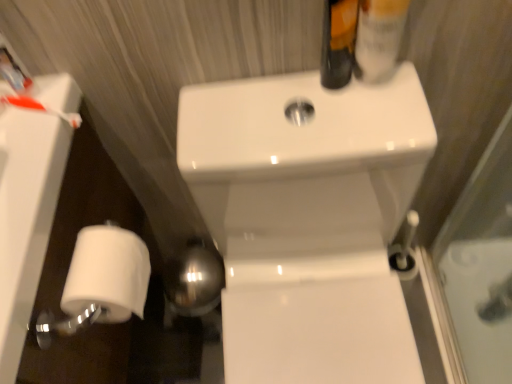
This screenshot has height=384, width=512. Describe the element at coordinates (309, 220) in the screenshot. I see `white glossy sink at center` at that location.

Describe the element at coordinates (379, 38) in the screenshot. I see `translucent plastic mouthwash at upper right` at that location.

This screenshot has height=384, width=512. Identify the location of matte black bottle at upper right. (338, 42).

From the picture: How distant is matte black bottle at upper right from white matte toilet paper at lower left?

A distance of 17.24 inches exists between matte black bottle at upper right and white matte toilet paper at lower left.

From the picture: Is matte black bottle at upper right positioned with its back to white matte toilet paper at lower left?

No, matte black bottle at upper right's orientation is not away from white matte toilet paper at lower left.

Considering the sizes of matte black bottle at upper right and white matte toilet paper at lower left in the image, is matte black bottle at upper right taller or shorter than white matte toilet paper at lower left?

In the image, matte black bottle at upper right appears to be taller than white matte toilet paper at lower left.

Does point (348, 78) lie behind point (142, 246)?

That is False.

Is white matte toilet paper at lower left facing away from translucent plastic mouthwash at upper right?

No, translucent plastic mouthwash at upper right is not at the back of white matte toilet paper at lower left.

Is white matte toilet paper at lower left outside of translucent plastic mouthwash at upper right?

Absolutely, white matte toilet paper at lower left is external to translucent plastic mouthwash at upper right.

Between white matte toilet paper at lower left and translucent plastic mouthwash at upper right, which one has larger size?

white matte toilet paper at lower left is bigger.

Who is taller, white matte toilet paper at lower left or translucent plastic mouthwash at upper right?

white matte toilet paper at lower left is taller.

Is white matte toilet paper at lower left thinner than white matte toilet paper at lower left?

Yes, white matte toilet paper at lower left is thinner than white matte toilet paper at lower left.

Can you tell me how much white matte toilet paper at lower left and white matte toilet paper at lower left differ in facing direction?

91.1 degrees separate the facing orientations of white matte toilet paper at lower left and white matte toilet paper at lower left.

Considering the relative sizes of white matte toilet paper at lower left and white matte toilet paper at lower left in the image provided, is white matte toilet paper at lower left shorter than white matte toilet paper at lower left?

Yes, white matte toilet paper at lower left is shorter than white matte toilet paper at lower left.

Could you tell me if matte black bottle at upper right is turned towards white glossy sink at center?

No, matte black bottle at upper right is not facing towards white glossy sink at center.

Locate an element on the screen. bottle that is behind the white glossy sink at center is located at coordinates (338, 42).

In the image, is matte black bottle at upper right positioned in front of or behind white glossy sink at center?

Visually, matte black bottle at upper right is located behind white glossy sink at center.

Is translucent plastic mouthwash at upper right closer to camera compared to white glossy sink at center?

No, translucent plastic mouthwash at upper right is behind white glossy sink at center.

From the image's perspective, would you say translucent plastic mouthwash at upper right is positioned over white glossy sink at center?

Indeed, from the image's perspective, translucent plastic mouthwash at upper right is shown above white glossy sink at center.

Considering the sizes of translucent plastic mouthwash at upper right and white glossy sink at center in the image, is translucent plastic mouthwash at upper right taller or shorter than white glossy sink at center?

Considering their sizes, translucent plastic mouthwash at upper right has less height than white glossy sink at center.

In the scene shown: Is translucent plastic mouthwash at upper right turned away from white glossy sink at center?

No, translucent plastic mouthwash at upper right's orientation is not away from white glossy sink at center.

From the picture: Between white matte toilet paper at lower left and white glossy sink at center, which one is positioned behind?

Positioned behind is white matte toilet paper at lower left.

Image resolution: width=512 pixels, height=384 pixels. I want to click on sink below the white matte toilet paper at lower left (from the image's perspective), so click(309, 220).

From a real-world perspective, is white matte toilet paper at lower left positioned above or below white glossy sink at center?

white matte toilet paper at lower left is situated higher than white glossy sink at center in the real world.

How far apart are white matte toilet paper at lower left and matte black bottle at upper right?

white matte toilet paper at lower left and matte black bottle at upper right are 17.24 inches apart from each other.

Relative to matte black bottle at upper right, is white matte toilet paper at lower left in front or behind?

white matte toilet paper at lower left is positioned farther from the viewer than matte black bottle at upper right.

From a real-world perspective, is white matte toilet paper at lower left located beneath matte black bottle at upper right?

Yes, from a real-world perspective, white matte toilet paper at lower left is under matte black bottle at upper right.

Who is bigger, white matte toilet paper at lower left or matte black bottle at upper right?

With larger size is white matte toilet paper at lower left.

Image resolution: width=512 pixels, height=384 pixels. In order to click on bottle above the white matte toilet paper at lower left (from a real-world perspective) in this screenshot , I will do `click(338, 42)`.

Locate an element on the screen. Image resolution: width=512 pixels, height=384 pixels. bath below the translucent plastic mouthwash at upper right (from a real-world perspective) is located at coordinates (26, 217).

Looking at the image, which one is located closer to white matte toilet paper at lower left, white matte toilet paper at lower left or white glossy sink at center?

white matte toilet paper at lower left.

When comparing their distances from matte black bottle at upper right, does white matte toilet paper at lower left or translucent plastic mouthwash at upper right seem further?

The object further to matte black bottle at upper right is white matte toilet paper at lower left.

From the image, which object appears to be farther from translucent plastic mouthwash at upper right, white matte toilet paper at lower left or white matte toilet paper at lower left?

white matte toilet paper at lower left is further to translucent plastic mouthwash at upper right.

Based on their spatial positions, is white glossy sink at center or white matte toilet paper at lower left closer to white matte toilet paper at lower left?

Among the two, white matte toilet paper at lower left is located nearer to white matte toilet paper at lower left.

Based on their spatial positions, is white matte toilet paper at lower left or white matte toilet paper at lower left further from white glossy sink at center?

Based on the image, white matte toilet paper at lower left appears to be further to white glossy sink at center.

Looking at the image, which one is located further to white matte toilet paper at lower left, translucent plastic mouthwash at upper right or matte black bottle at upper right?

Based on the image, translucent plastic mouthwash at upper right appears to be further to white matte toilet paper at lower left.

Considering their positions, is translucent plastic mouthwash at upper right positioned closer to white matte toilet paper at lower left than white matte toilet paper at lower left?

The object closer to white matte toilet paper at lower left is white matte toilet paper at lower left.

From the image, which object appears to be nearer to white matte toilet paper at lower left, matte black bottle at upper right or white matte toilet paper at lower left?

white matte toilet paper at lower left is closer to white matte toilet paper at lower left.

Find the location of a particular element. toilet paper between white matte toilet paper at lower left and translucent plastic mouthwash at upper right from left to right is located at coordinates (106, 274).

Find the location of `sink between white matte toilet paper at lower left and translucent plastic mouthwash at upper right in the horizontal direction`. sink between white matte toilet paper at lower left and translucent plastic mouthwash at upper right in the horizontal direction is located at coordinates (309, 220).

This screenshot has width=512, height=384. Identify the location of bottle located between white matte toilet paper at lower left and translucent plastic mouthwash at upper right in the left-right direction. (338, 42).

Where is `toilet paper between matte black bottle at upper right and white glossy sink at center in the vertical direction`? Image resolution: width=512 pixels, height=384 pixels. toilet paper between matte black bottle at upper right and white glossy sink at center in the vertical direction is located at coordinates (106, 274).